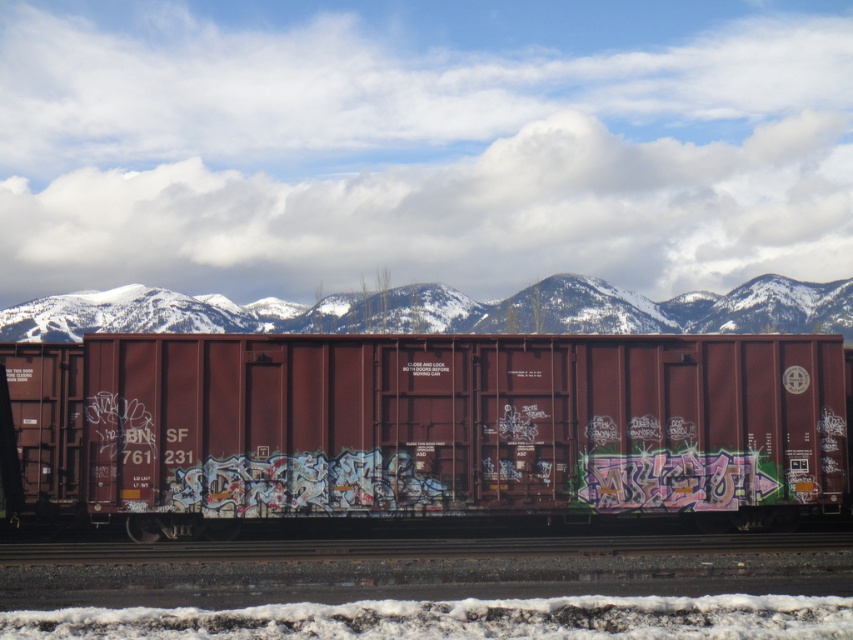
You are a photographer planning to take a photo of the maroon matte freight car at center and the snowy mountains at upper center. Based on the scene, which object is closer to the camera?

The maroon matte freight car at center is closer to the camera because it is in front of the snowy mountains at upper center.

You are an observer standing on the railway tracks. You see the maroon matte freight car at center and the snowy mountains at upper center. Which object is closer to your left side?

The snowy mountains at upper center are closer to your left side because the maroon matte freight car at center is positioned on the right side of snowy mountains at upper center.